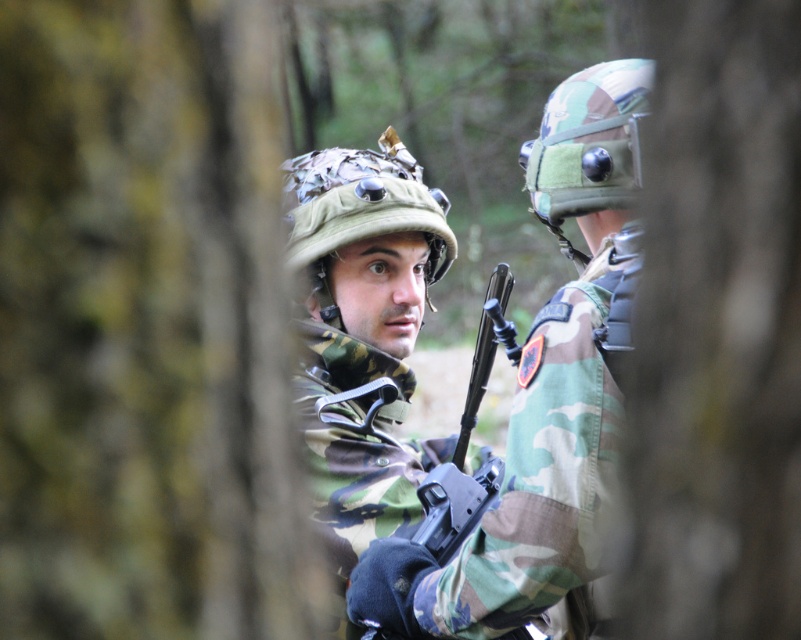
You are a drone operator trying to capture coordinates on a map. You see two points in the image, point 1 at point (667, 90) and point 2 at point (580, 291). Which point is closer to the camera?

Point (667, 90) is closer to the camera than point (580, 291).

You are a drone operator controlling a drone that can only fly 6 meters above the ground. You need to hover the drone between the two points marked as point [361,390] and the other person. Will the drone be able to stay above them without going higher than 6 meters?

The two points are 5.99 meters apart, so the drone can hover between them at 6 meters altitude without exceeding the limit.